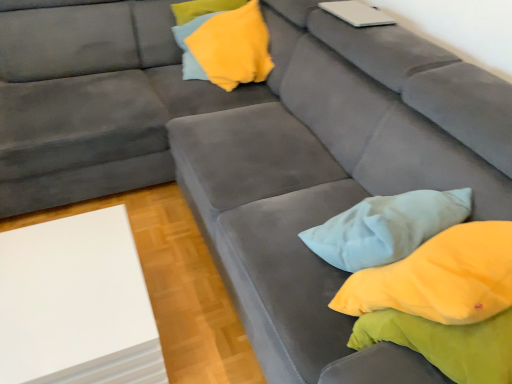
Question: From a real-world perspective, is yellow fabric pillow at upper center beneath white matte laptop at upper right?

Choices:
 (A) yes
 (B) no

Answer: (A)

Question: Can you confirm if yellow fabric pillow at upper center is taller than white matte laptop at upper right?

Choices:
 (A) no
 (B) yes

Answer: (B)

Question: From the image's perspective, does yellow fabric pillow at upper center appear higher than white matte laptop at upper right?

Choices:
 (A) yes
 (B) no

Answer: (B)

Question: Could white matte laptop at upper right be considered to be inside yellow fabric pillow at upper center?

Choices:
 (A) no
 (B) yes

Answer: (A)

Question: Is yellow fabric pillow at upper center smaller than white matte laptop at upper right?

Choices:
 (A) no
 (B) yes

Answer: (A)

Question: Is yellow fabric pillow at upper center positioned with its back to white matte laptop at upper right?

Choices:
 (A) yes
 (B) no

Answer: (B)

Question: Could you tell me if white matte board at lower left is turned towards white matte laptop at upper right?

Choices:
 (A) no
 (B) yes

Answer: (A)

Question: Is white matte laptop at upper right a part of white matte board at lower left?

Choices:
 (A) no
 (B) yes

Answer: (A)

Question: Is white matte board at lower left positioned with its back to white matte laptop at upper right?

Choices:
 (A) no
 (B) yes

Answer: (A)

Question: Does white matte board at lower left have a greater width compared to white matte laptop at upper right?

Choices:
 (A) yes
 (B) no

Answer: (A)

Question: Does white matte board at lower left have a greater height compared to white matte laptop at upper right?

Choices:
 (A) yes
 (B) no

Answer: (A)

Question: Is white matte board at lower left in front of white matte laptop at upper right?

Choices:
 (A) yes
 (B) no

Answer: (A)

Question: Can you confirm if white matte laptop at upper right is taller than white matte board at lower left?

Choices:
 (A) no
 (B) yes

Answer: (A)